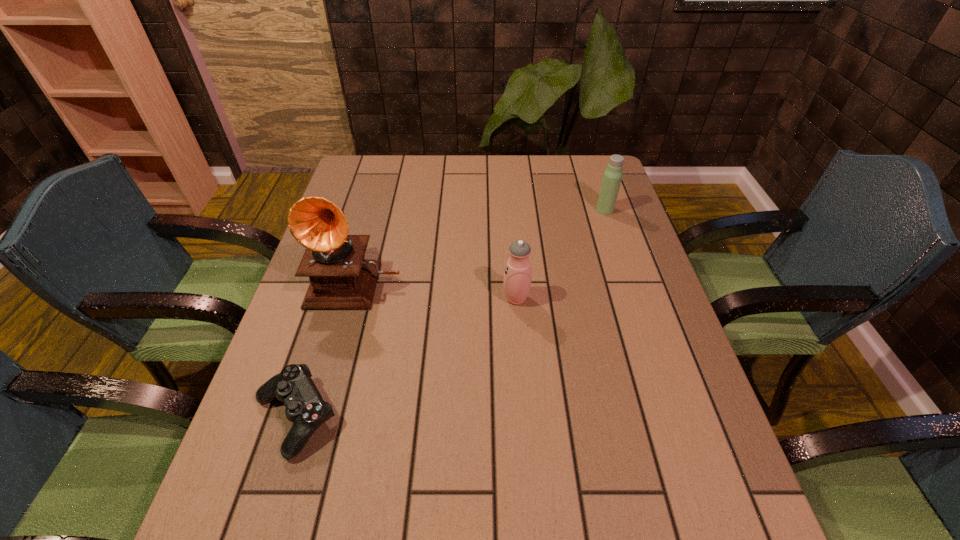
The width and height of the screenshot is (960, 540). In order to click on vacant space located on the right of the shortest object in this screenshot , I will do `click(399, 417)`.

Identify the location of phonograph record situated at the left edge. This screenshot has height=540, width=960. (340, 278).

This screenshot has width=960, height=540. Identify the location of control situated at the left edge. (305, 408).

The width and height of the screenshot is (960, 540). What are the coordinates of `object that is at the right edge` in the screenshot? It's located at (612, 177).

Where is `vacant space at the far edge of the desktop`? This screenshot has height=540, width=960. vacant space at the far edge of the desktop is located at coordinates (412, 171).

Image resolution: width=960 pixels, height=540 pixels. I want to click on vacant space at the left edge of the desktop, so click(x=287, y=484).

At what (x,y) coordinates should I click in order to perform the action: click on vacant position at the right edge of the desktop. Please return your answer as a coordinate pair (x, y). This screenshot has height=540, width=960. Looking at the image, I should click on (584, 242).

You are a GUI agent. You are given a task and a screenshot of the screen. Output one action in this format:
    pyautogui.click(x=<x>, y=<y>)
    Task: Click on the free spot at the far left corner of the desktop
    The image size is (960, 540).
    Given the screenshot: What is the action you would take?
    pyautogui.click(x=356, y=192)

You are a GUI agent. You are given a task and a screenshot of the screen. Output one action in this format:
    pyautogui.click(x=<x>, y=<y>)
    Task: Click on the free space at the near left corner of the desktop
    
    Given the screenshot: What is the action you would take?
    pyautogui.click(x=240, y=521)

Locate an element on the screen. Image resolution: width=960 pixels, height=540 pixels. empty space that is in between the phonograph record and the nearer thermos bottle is located at coordinates (437, 290).